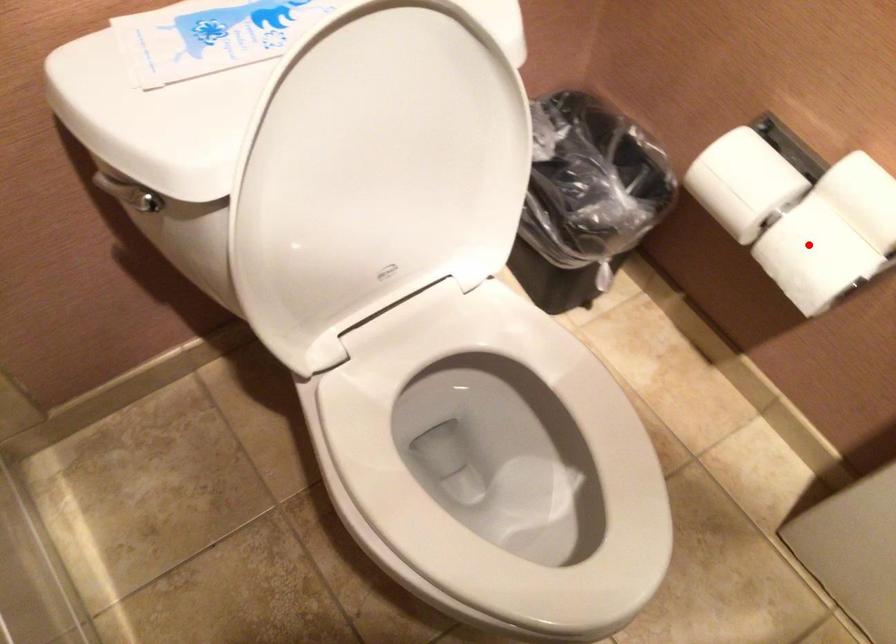
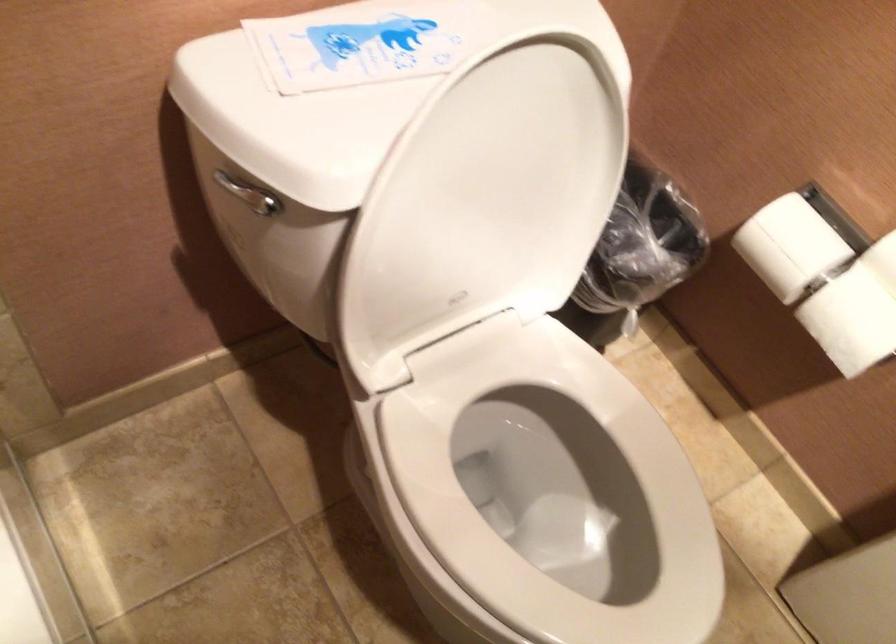
Locate, in the second image, the point that corresponds to the highlighted location in the first image.

(856, 310)